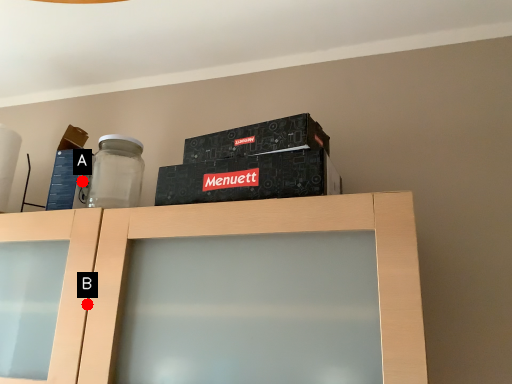
Question: Two points are circled on the image, labeled by A and B beside each circle. Which point is closer to the camera?

Choices:
 (A) A is closer
 (B) B is closer

Answer: (B)